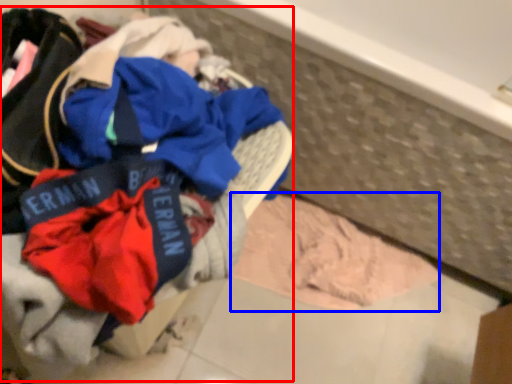
Question: Which object is further to the camera taking this photo, laundry (highlighted by a red box) or baby clothe (highlighted by a blue box)?

Choices:
 (A) laundry
 (B) baby clothe

Answer: (B)